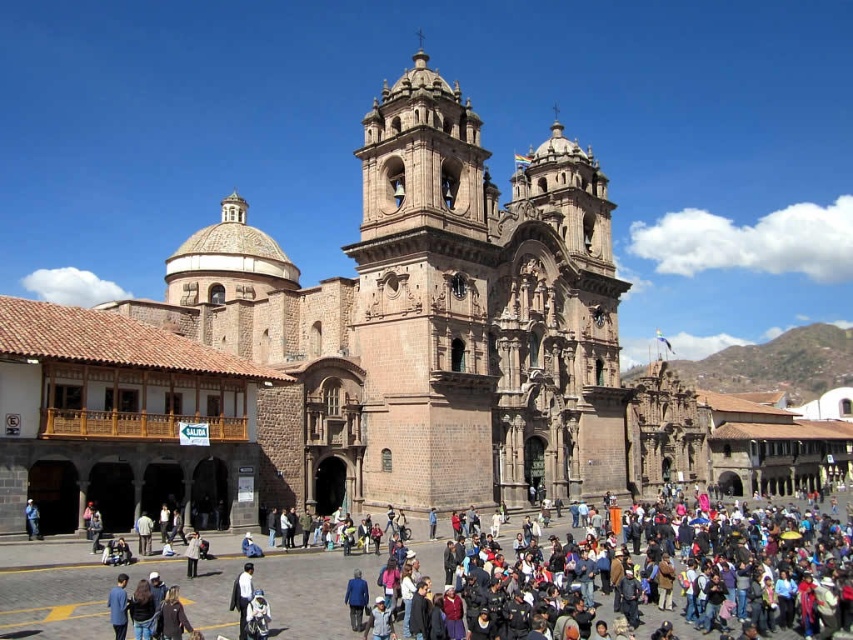
Question: Estimate the real-world distances between objects in this image. Which object is closer to the dark blue jeans at lower left?

Choices:
 (A) multicolored clothing at center
 (B) dark blue suit at center

Answer: (B)

Question: Which of the following is the farthest from the observer?

Choices:
 (A) (546, 628)
 (B) (430, 288)

Answer: (B)

Question: Is brown stone church at center behind multicolored clothing at center?

Choices:
 (A) yes
 (B) no

Answer: (A)

Question: Which point appears farthest from the camera in this image?

Choices:
 (A) (660, 573)
 (B) (242, 624)
 (C) (230, 524)
 (D) (39, 532)

Answer: (C)

Question: Does brown stone church at center have a larger size compared to multicolored clothing at center?

Choices:
 (A) no
 (B) yes

Answer: (B)

Question: Is multicolored clothing at center to the left of dark blue suit at center from the viewer's perspective?

Choices:
 (A) no
 (B) yes

Answer: (A)